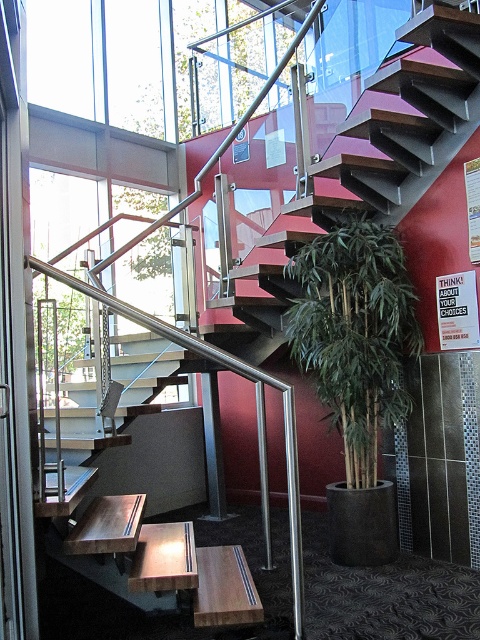
Who is higher up, green bamboo at center or wooden bench at lower center?

green bamboo at center is higher up.

What do you see at coordinates (356, 333) in the screenshot?
I see `green bamboo at center` at bounding box center [356, 333].

At what (x,y) coordinates should I click in order to perform the action: click on green bamboo at center. Please return your answer as a coordinate pair (x, y). The width and height of the screenshot is (480, 640). Looking at the image, I should click on (356, 333).